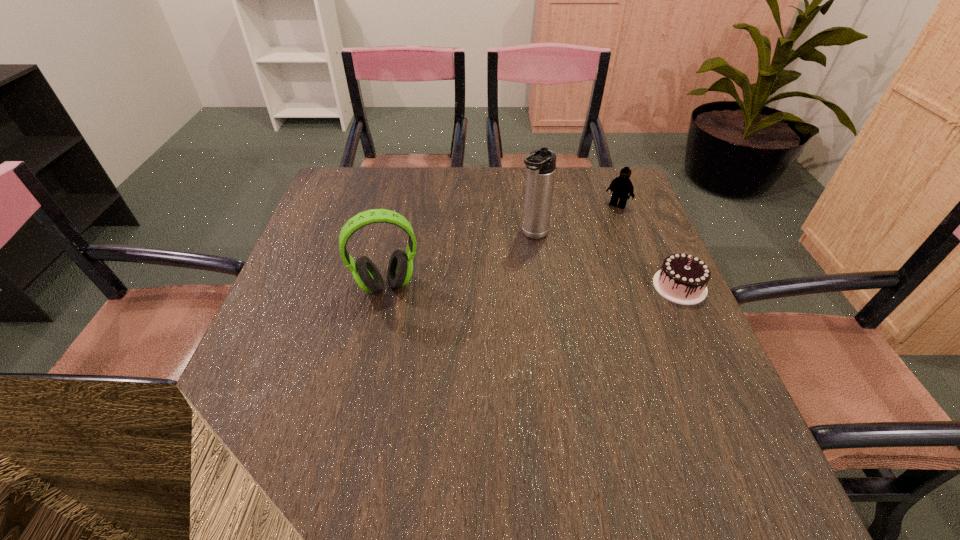
Identify the location of vacant area that satisfies the following two spatial constraints: 1. on the back side of the leftmost object; 2. on the left side of the Lego. coord(403,205).